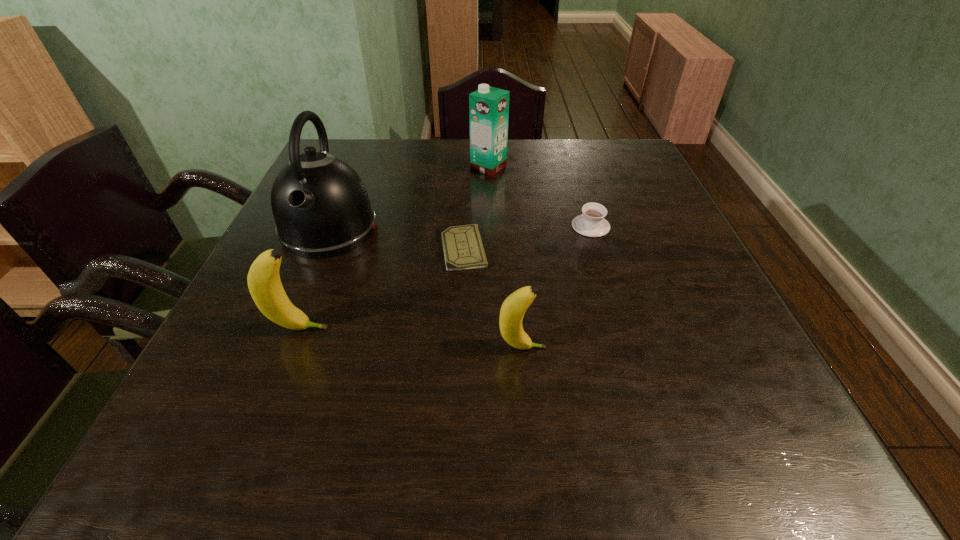
This screenshot has width=960, height=540. I want to click on kettle at the left edge, so click(x=321, y=208).

I want to click on vacant space at the far edge, so click(x=567, y=154).

Image resolution: width=960 pixels, height=540 pixels. Identify the location of free region at the near edge of the desktop. (495, 366).

Where is `vacant space at the left edge`? vacant space at the left edge is located at coordinates coord(324,288).

Image resolution: width=960 pixels, height=540 pixels. I want to click on free spot at the right edge of the desktop, so click(x=607, y=200).

Where is `free space at the far left corner of the desktop`? Image resolution: width=960 pixels, height=540 pixels. free space at the far left corner of the desktop is located at coordinates (353, 156).

You are a GUI agent. You are given a task and a screenshot of the screen. Output one action in this format:
    pyautogui.click(x=<x>, y=<y>)
    Task: Click on the free space at the near left corner of the desktop
    
    Given the screenshot: What is the action you would take?
    pyautogui.click(x=276, y=362)

I want to click on free point at the far right corner, so click(629, 152).

You are a GUI agent. You are given a task and a screenshot of the screen. Output one action in this format:
    pyautogui.click(x=<x>, y=<y>)
    Task: Click on the free space that is in between the tallest object and the checkbook
    This screenshot has width=960, height=540.
    Given the screenshot: What is the action you would take?
    pyautogui.click(x=396, y=239)

The height and width of the screenshot is (540, 960). Find the location of `free space between the checkbook and the second nearest object`. free space between the checkbook and the second nearest object is located at coordinates point(381,289).